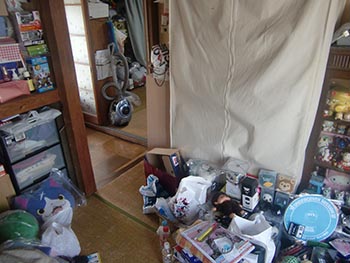
Point to any i think its a vaccuum in the image. Your answer should be formatted as a list of tuples, i.e. [(x1, y1), (x2, y2), ...], where each tuple contains the x and y coordinates of a point satisfying the conditions above.

[(121, 92)]